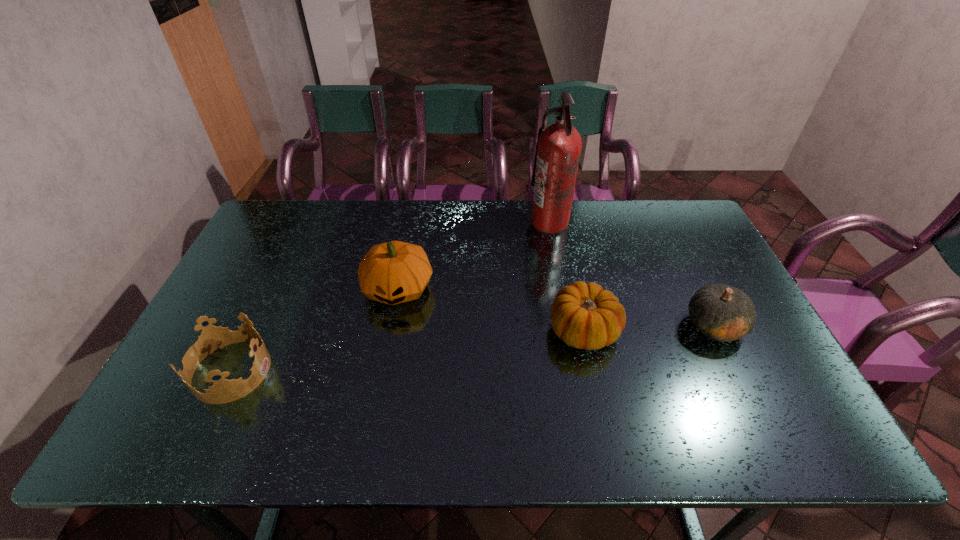
The width and height of the screenshot is (960, 540). I want to click on object identified as the fourth closest to the second gourd from right to left, so click(x=212, y=338).

Identify which object is the fourth nearest to the second gourd from left to right. Please provide its 2D coordinates. Your answer should be formatted as a tuple, i.e. [(x, y)], where the tuple contains the x and y coordinates of a point satisfying the conditions above.

[(212, 338)]

Select which gourd is the second closest to the fire extinguisher. Please provide its 2D coordinates. Your answer should be formatted as a tuple, i.e. [(x, y)], where the tuple contains the x and y coordinates of a point satisfying the conditions above.

[(394, 272)]

Find the location of `gourd identified as the closest to the rightmost object`. gourd identified as the closest to the rightmost object is located at coordinates (584, 316).

You are a GUI agent. You are given a task and a screenshot of the screen. Output one action in this format:
    pyautogui.click(x=<x>, y=<y>)
    Task: Click on the vacant area in the image that satisfies the following two spatial constraints: 1. on the back side of the rightmost object; 2. on the front of the tallest object near the operation label
    
    Given the screenshot: What is the action you would take?
    pyautogui.click(x=663, y=222)

Where is `vacant area in the image that satisfies the following two spatial constraints: 1. on the front side of the second gourd from right to left; 2. on the front-facing side of the tiara`? The image size is (960, 540). vacant area in the image that satisfies the following two spatial constraints: 1. on the front side of the second gourd from right to left; 2. on the front-facing side of the tiara is located at coordinates (593, 371).

Locate an element on the screen. This screenshot has height=540, width=960. free location that satisfies the following two spatial constraints: 1. on the side of the second gourd from right to left with the carved face; 2. on the left side of the fourth object from right to left is located at coordinates [390, 330].

Identify the location of free region that satisfies the following two spatial constraints: 1. on the side of the second object from left to right with the carved face; 2. on the front-facing side of the leftmost object. The image size is (960, 540). (382, 371).

The image size is (960, 540). Find the location of `vacant point that satisfies the following two spatial constraints: 1. on the side of the fourth shortest object with the carved face; 2. on the front-facing side of the leftmost object`. vacant point that satisfies the following two spatial constraints: 1. on the side of the fourth shortest object with the carved face; 2. on the front-facing side of the leftmost object is located at coordinates (382, 371).

You are a GUI agent. You are given a task and a screenshot of the screen. Output one action in this format:
    pyautogui.click(x=<x>, y=<y>)
    Task: Click on the free space that satisfies the following two spatial constraints: 1. on the front of the farthest object near the operation label; 2. on the side of the second object from left to right with the carved face
    The image size is (960, 540).
    Given the screenshot: What is the action you would take?
    pyautogui.click(x=562, y=288)